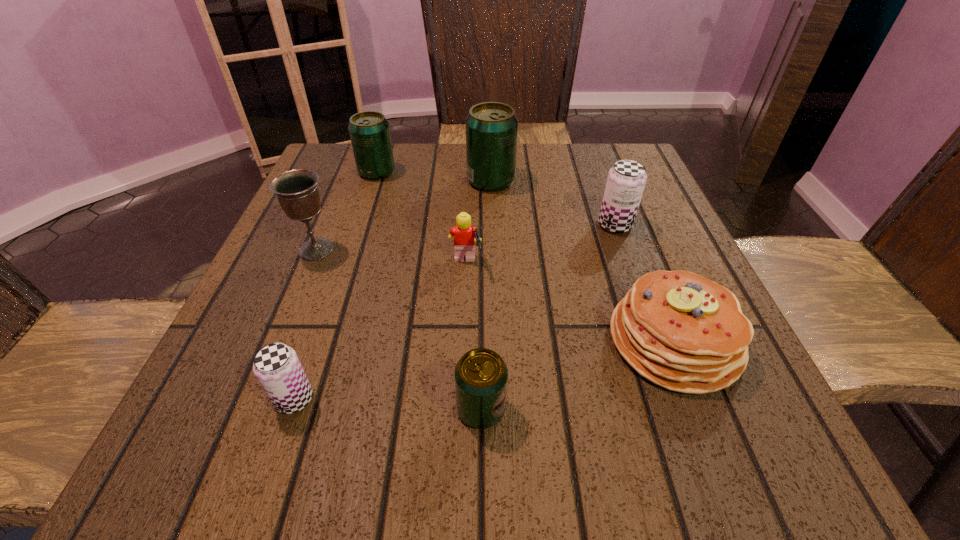
Locate an element on the screen. vacant region located on the right of the tallest beer can is located at coordinates (592, 181).

Find the location of a particular element. The height and width of the screenshot is (540, 960). vacant area situated 0.160m on the back of the bronze chalice is located at coordinates (340, 191).

The height and width of the screenshot is (540, 960). Find the location of `vacant area situated 0.090m on the right of the right purple beer can`. vacant area situated 0.090m on the right of the right purple beer can is located at coordinates [x=677, y=225].

This screenshot has width=960, height=540. I want to click on vacant region located on the front of the second biggest green beer can, so click(x=369, y=197).

Locate an element on the screen. The width and height of the screenshot is (960, 540). free spot located in front of the Lego with the accessory visible is located at coordinates [x=651, y=265].

Find the location of a particular element. free space located 0.310m on the left of the pancake is located at coordinates (411, 341).

Locate an element on the screen. blank area located 0.320m on the right of the smaller purple beer can is located at coordinates coord(544,399).

Identify the location of vacant region located 0.070m on the right of the smallest green beer can. The width and height of the screenshot is (960, 540). (557, 409).

Where is `chalice present at the left edge`? chalice present at the left edge is located at coordinates (296, 190).

I want to click on beer can that is at the right edge, so click(626, 180).